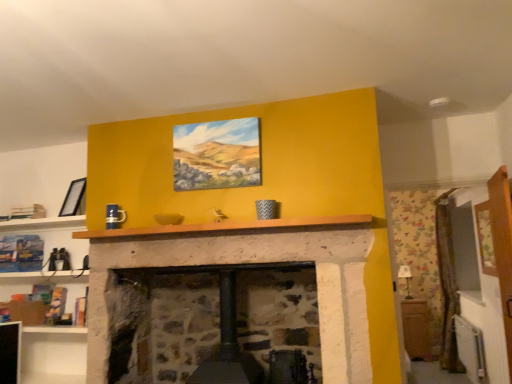
At what (x,y) coordinates should I click in order to perform the action: click on free spot below matte canvas painting at center, the first picture frame in the front-to-back sequence (from a real-world perspective). Please return your answer as a coordinate pair (x, y). The image size is (512, 384). Looking at the image, I should click on click(216, 218).